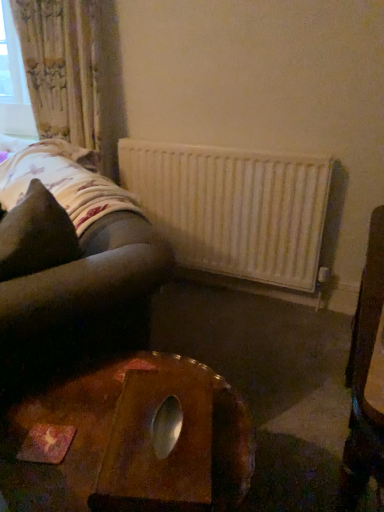
The height and width of the screenshot is (512, 384). Identify the location of blank space above wooden table at center (from a real-world perspective). (108, 414).